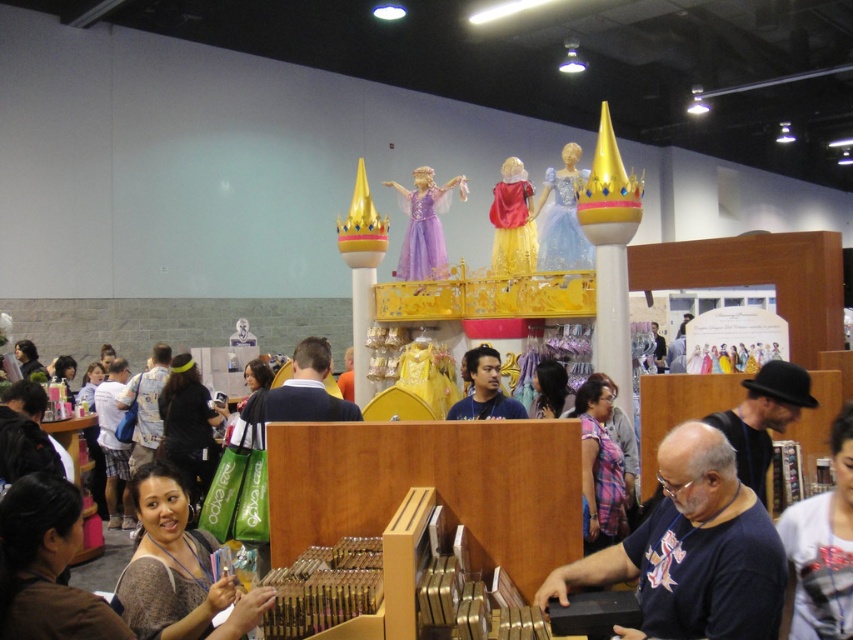
Question: Does matte brown blouse at lower left have a larger size compared to satin blue dress at upper center?

Choices:
 (A) yes
 (B) no

Answer: (B)

Question: From the image, what is the correct spatial relationship of matte brown blouse at lower left in relation to white printed shirt at lower right?

Choices:
 (A) right
 (B) left

Answer: (B)

Question: Which object is the farthest from the dark blue t-shirt at lower right?

Choices:
 (A) satin blue dress at upper center
 (B) plaid fabric dress at center
 (C) matte blue shirt at center

Answer: (A)

Question: Which of these objects is positioned farthest from the white printed shirt at lower right?

Choices:
 (A) matte red dress at center
 (B) matte purple dress at center

Answer: (B)

Question: Is dark blue t-shirt at lower right bigger than matte purple dress at center?

Choices:
 (A) no
 (B) yes

Answer: (A)

Question: Considering the real-world distances, which object is farthest from the matte red dress at center?

Choices:
 (A) plaid fabric dress at center
 (B) matte blue shirt at center
 (C) white printed shirt at lower right
 (D) dark blue t-shirt at lower right

Answer: (D)